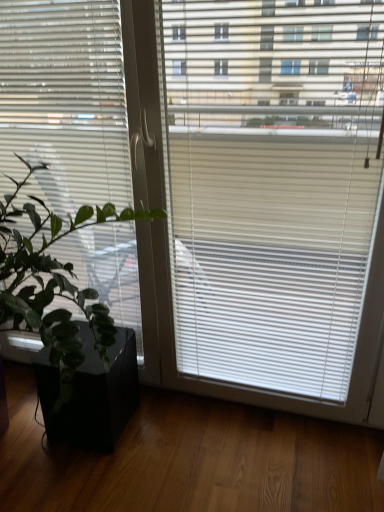
Where is `free spot in front of black matte flowerpot at lower left`? free spot in front of black matte flowerpot at lower left is located at coordinates (84, 479).